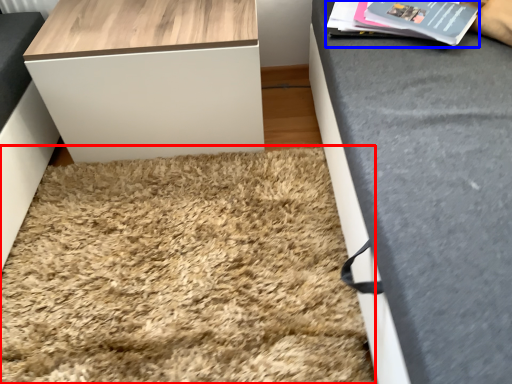
Question: Which of the following is the closest to the observer, mat (highlighted by a red box) or magazine (highlighted by a blue box)?

Choices:
 (A) mat
 (B) magazine

Answer: (A)